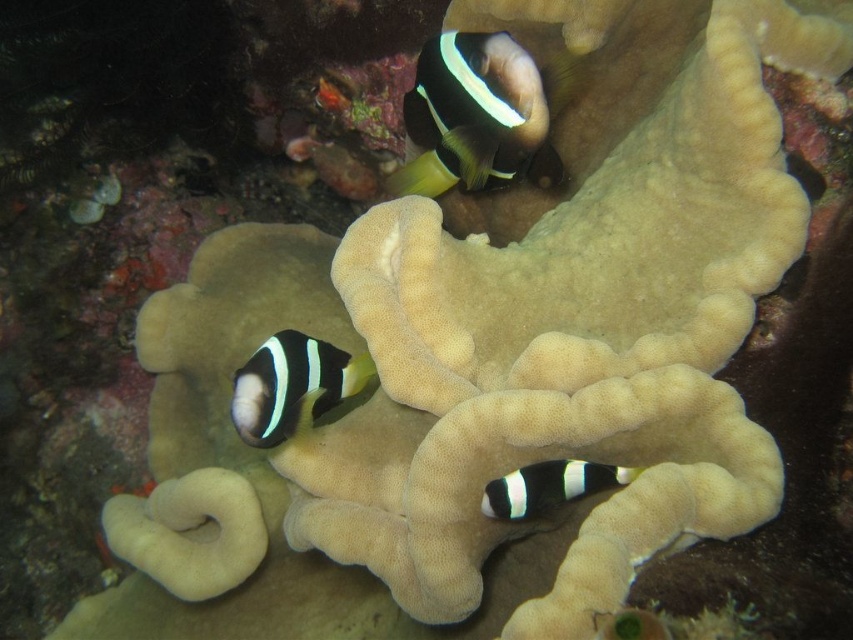
Does point (524, 68) come in front of point (288, 397)?

Yes, it is.

Is black matte clownfish at upper center above black and white striped fish at lower left?

Yes, black matte clownfish at upper center is above black and white striped fish at lower left.

Measure the distance between black matte clownfish at upper center and camera.

black matte clownfish at upper center is 1.10 meters from camera.

Locate an element on the screen. The image size is (853, 640). black matte clownfish at upper center is located at coordinates (479, 115).

Consider the image. Between black matte clownfish at upper center and black matte clownfish at lower center, which one is positioned lower?

Positioned lower is black matte clownfish at lower center.

Identify the location of black matte clownfish at upper center. The height and width of the screenshot is (640, 853). (479, 115).

Between point (440, 93) and point (572, 467), which one is positioned in front?

Point (572, 467)

I want to click on black matte clownfish at upper center, so click(479, 115).

At what (x,y) coordinates should I click in order to perform the action: click on black and white striped fish at lower left. Please return your answer as a coordinate pair (x, y). The image size is (853, 640). Looking at the image, I should click on (292, 385).

Consider the image. Does black and white striped fish at lower left have a lesser height compared to black matte clownfish at lower center?

No.

Where is `black and white striped fish at lower left`? Image resolution: width=853 pixels, height=640 pixels. black and white striped fish at lower left is located at coordinates (292, 385).